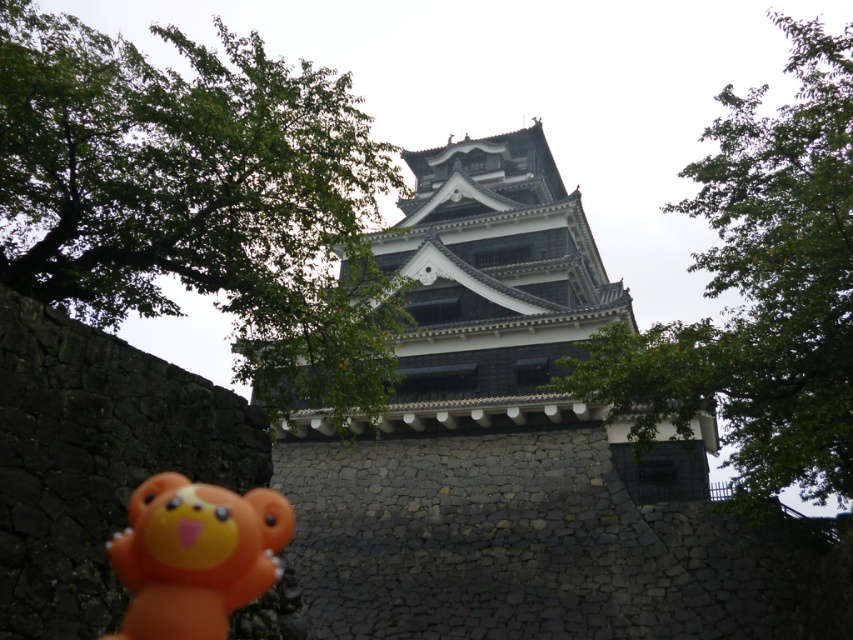
Question: Is green leafy tree at upper left thinner than green leafy tree at upper right?

Choices:
 (A) yes
 (B) no

Answer: (A)

Question: Which point is closer to the camera?

Choices:
 (A) green leafy tree at upper left
 (B) green leafy tree at upper right

Answer: (A)

Question: Which point is farther to the camera?

Choices:
 (A) (193, 524)
 (B) (236, 154)
 (C) (592, 372)

Answer: (C)

Question: Is green leafy tree at upper left wider than orange rubber bear at lower left?

Choices:
 (A) yes
 (B) no

Answer: (A)

Question: Does green leafy tree at upper left have a greater width compared to orange rubber bear at lower left?

Choices:
 (A) yes
 (B) no

Answer: (A)

Question: Estimate the real-world distances between objects in this image. Which object is closer to the green leafy tree at upper left?

Choices:
 (A) green leafy tree at upper right
 (B) orange rubber bear at lower left

Answer: (B)